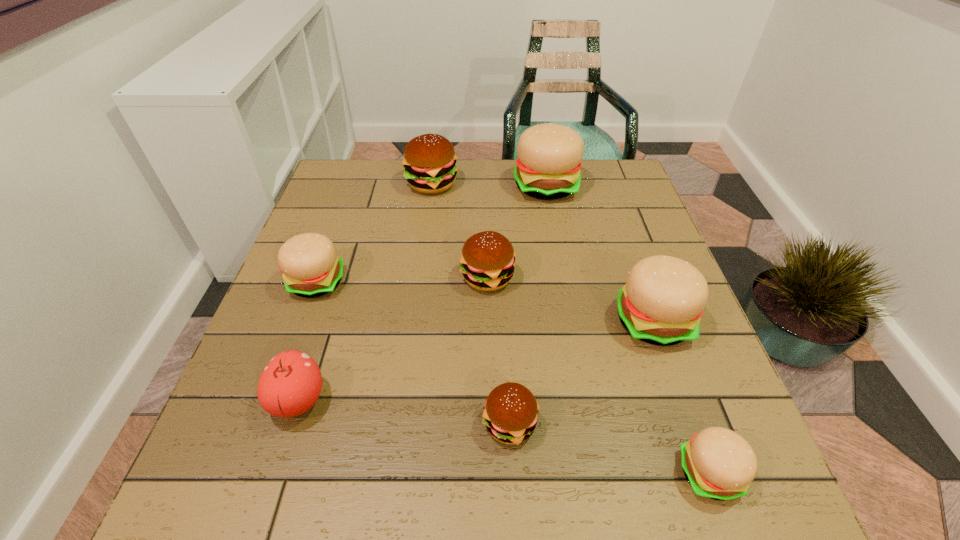
The height and width of the screenshot is (540, 960). Find the location of `hamburger that is the sixth closest one to the second farthest brown hamburger`. hamburger that is the sixth closest one to the second farthest brown hamburger is located at coordinates (720, 464).

Locate an element on the screen. This screenshot has width=960, height=540. beige hamburger that is the nearest to the second biggest beige hamburger is located at coordinates (720, 464).

Locate an element on the screen. Image resolution: width=960 pixels, height=540 pixels. beige hamburger that stands as the fourth closest to the smallest brown hamburger is located at coordinates (548, 166).

Choose which brown hamburger is the second nearest neighbor to the second biggest brown hamburger. Please provide its 2D coordinates. Your answer should be formatted as a tuple, i.e. [(x, y)], where the tuple contains the x and y coordinates of a point satisfying the conditions above.

[(511, 410)]

Identify the location of brown hamburger that is the second closest to the biggest brown hamburger. (511, 410).

I want to click on vacant space that satisfies the following two spatial constraints: 1. on the front side of the smallest brown hamburger; 2. on the left side of the red apple, so [x=291, y=423].

You are a GUI agent. You are given a task and a screenshot of the screen. Output one action in this format:
    pyautogui.click(x=<x>, y=<y>)
    Task: Click on the free spot that satisfies the following two spatial constraints: 1. on the back side of the biggest brown hamburger; 2. on the left side of the leftmost beige hamburger
    Image resolution: width=960 pixels, height=540 pixels.
    Given the screenshot: What is the action you would take?
    pyautogui.click(x=352, y=184)